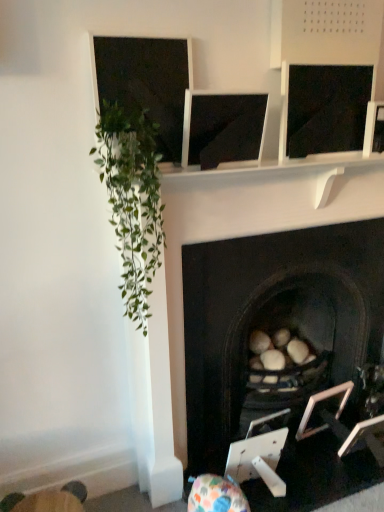
Describe the element at coordinates (276, 323) in the screenshot. I see `black stone fireplace at center` at that location.

What is the approximate height of metallic silver picture frame at lower right, marked as the first picture frame in a right-to-left arrangement?

metallic silver picture frame at lower right, marked as the first picture frame in a right-to-left arrangement, is 8.47 inches tall.

What do you see at coordinates (55, 500) in the screenshot?
I see `wooden swivel chair at lower left` at bounding box center [55, 500].

What do you see at coordinates (222, 128) in the screenshot?
I see `matte black monitor at center` at bounding box center [222, 128].

What do you see at coordinates (132, 201) in the screenshot? I see `green leafy plant at left` at bounding box center [132, 201].

Image resolution: width=384 pixels, height=512 pixels. Identify the location of black stone fireplace at center. (276, 323).

Looking at this image, is metallic silver picture frame at lower right, marked as the first picture frame in a right-to-left arrangement, inside wooden swivel chair at lower left?

No.

Is wooden swivel chair at lower left to the left or to the right of metallic silver picture frame at lower right, which ranks as the second picture frame in left-to-right order, in the image?

In the image, wooden swivel chair at lower left appears on the left side of metallic silver picture frame at lower right, which ranks as the second picture frame in left-to-right order.

Considering the sizes of wooden swivel chair at lower left and metallic silver picture frame at lower right, which ranks as the second picture frame in left-to-right order, in the image, is wooden swivel chair at lower left bigger or smaller than metallic silver picture frame at lower right, which ranks as the second picture frame in left-to-right order,?

In the image, wooden swivel chair at lower left appears to be larger than metallic silver picture frame at lower right, which ranks as the second picture frame in left-to-right order.

Could you tell me if wooden swivel chair at lower left is facing black stone fireplace at center?

No, wooden swivel chair at lower left is not aimed at black stone fireplace at center.

In the scene shown: Is wooden swivel chair at lower left shorter than black stone fireplace at center?

Yes, wooden swivel chair at lower left is shorter than black stone fireplace at center.

What's the angular difference between wooden swivel chair at lower left and black stone fireplace at center's facing directions?

The facing directions of wooden swivel chair at lower left and black stone fireplace at center are 7.02 degrees apart.

Is wooden swivel chair at lower left at the right side of black stone fireplace at center?

Incorrect, wooden swivel chair at lower left is not on the right side of black stone fireplace at center.

Is black stone fireplace at center situated inside metallic silver picture frame at lower right, marked as the first picture frame in a right-to-left arrangement, or outside?

black stone fireplace at center is located beyond the bounds of metallic silver picture frame at lower right, marked as the first picture frame in a right-to-left arrangement.

From a real-world perspective, is black stone fireplace at center under metallic silver picture frame at lower right, which ranks as the second picture frame in left-to-right order?

No.

Between black stone fireplace at center and metallic silver picture frame at lower right, which ranks as the second picture frame in left-to-right order, which one has larger size?

black stone fireplace at center is bigger.

Looking at this image, considering the positions of objects black stone fireplace at center and metallic silver picture frame at lower right, marked as the first picture frame in a right-to-left arrangement, in the image provided, who is more to the left, black stone fireplace at center or metallic silver picture frame at lower right, marked as the first picture frame in a right-to-left arrangement,?

From the viewer's perspective, black stone fireplace at center appears more on the left side.

The height and width of the screenshot is (512, 384). In order to click on picture frame on the left of metallic silver picture frame at lower right, which ranks as the second picture frame in left-to-right order in this screenshot , I will do `click(320, 401)`.

From the image's perspective, which is above, metallic silver picture frame at lower right, arranged as the 1th picture frame when viewed from the left, or metallic silver picture frame at lower right, marked as the first picture frame in a right-to-left arrangement?

metallic silver picture frame at lower right, arranged as the 1th picture frame when viewed from the left.

Considering the positions of point (343, 395) and point (349, 452), is point (343, 395) closer or farther from the camera than point (349, 452)?

Point (343, 395) appears to be farther away from the viewer than point (349, 452).

Looking at their sizes, would you say metallic silver picture frame at lower right, marked as the 2th picture frame in a right-to-left arrangement, is wider or thinner than metallic silver picture frame at lower right, marked as the first picture frame in a right-to-left arrangement?

metallic silver picture frame at lower right, marked as the 2th picture frame in a right-to-left arrangement, is thinner than metallic silver picture frame at lower right, marked as the first picture frame in a right-to-left arrangement.

From the image's perspective, is wooden swivel chair at lower left positioned above or below metallic silver picture frame at lower right, arranged as the 1th picture frame when viewed from the left?

Clearly, from the image's perspective, wooden swivel chair at lower left is below metallic silver picture frame at lower right, arranged as the 1th picture frame when viewed from the left.

Based on their sizes in the image, would you say wooden swivel chair at lower left is bigger or smaller than metallic silver picture frame at lower right, marked as the 2th picture frame in a right-to-left arrangement?

wooden swivel chair at lower left is smaller than metallic silver picture frame at lower right, marked as the 2th picture frame in a right-to-left arrangement.

Consider the image. Is wooden swivel chair at lower left inside or outside of metallic silver picture frame at lower right, arranged as the 1th picture frame when viewed from the left?

The correct answer is: outside.

Based on the photo, is there a large distance between wooden swivel chair at lower left and metallic silver picture frame at lower right, arranged as the 1th picture frame when viewed from the left?

Yes, wooden swivel chair at lower left is far from metallic silver picture frame at lower right, arranged as the 1th picture frame when viewed from the left.

Are black stone fireplace at center and wooden swivel chair at lower left making contact?

No, black stone fireplace at center is not in contact with wooden swivel chair at lower left.

Considering the positions of points (194, 466) and (78, 501), is point (194, 466) closer to camera compared to point (78, 501)?

That is False.

In order to click on fireplace on the right of wooden swivel chair at lower left in this screenshot , I will do `click(276, 323)`.

Considering the sizes of black stone fireplace at center and wooden swivel chair at lower left in the image, is black stone fireplace at center taller or shorter than wooden swivel chair at lower left?

Clearly, black stone fireplace at center is taller compared to wooden swivel chair at lower left.

Which is nearer, [133,174] or [369,438]?

Point [133,174]

From the image's perspective, who appears lower, green leafy plant at left or metallic silver picture frame at lower right, marked as the first picture frame in a right-to-left arrangement?

From the image's view, metallic silver picture frame at lower right, marked as the first picture frame in a right-to-left arrangement, is below.

Is metallic silver picture frame at lower right, which ranks as the second picture frame in left-to-right order, at the back of green leafy plant at left?

No, metallic silver picture frame at lower right, which ranks as the second picture frame in left-to-right order, is not at the back of green leafy plant at left.

This screenshot has height=512, width=384. In order to click on picture frame that is under the wooden swivel chair at lower left (from a real-world perspective) in this screenshot , I will do `click(366, 438)`.

The width and height of the screenshot is (384, 512). I want to click on fireplace located above the wooden swivel chair at lower left (from the image's perspective), so click(276, 323).

From the picture: Based on their spatial positions, is metallic silver picture frame at lower right, marked as the first picture frame in a right-to-left arrangement, or metallic silver picture frame at lower right, arranged as the 1th picture frame when viewed from the left, closer to matte black monitor at center?

metallic silver picture frame at lower right, marked as the first picture frame in a right-to-left arrangement, is closer to matte black monitor at center.

Based on their spatial positions, is metallic silver picture frame at lower right, which ranks as the second picture frame in left-to-right order, or metallic silver picture frame at lower right, marked as the 2th picture frame in a right-to-left arrangement, further from green leafy plant at left?

The object further to green leafy plant at left is metallic silver picture frame at lower right, marked as the 2th picture frame in a right-to-left arrangement.

From the image, which object appears to be farther from matte black monitor at center, metallic silver picture frame at lower right, marked as the first picture frame in a right-to-left arrangement, or wooden swivel chair at lower left?

wooden swivel chair at lower left lies further to matte black monitor at center than the other object.

When comparing their distances from metallic silver picture frame at lower right, marked as the first picture frame in a right-to-left arrangement, does matte black monitor at center or black stone fireplace at center seem closer?

black stone fireplace at center is positioned closer to the anchor metallic silver picture frame at lower right, marked as the first picture frame in a right-to-left arrangement.

Estimate the real-world distances between objects in this image. Which object is further from green leafy plant at left, matte black monitor at center or black stone fireplace at center?

The object further to green leafy plant at left is black stone fireplace at center.

Considering their positions, is metallic silver picture frame at lower right, marked as the first picture frame in a right-to-left arrangement, positioned closer to black stone fireplace at center than metallic silver picture frame at lower right, marked as the 2th picture frame in a right-to-left arrangement?

Based on the image, metallic silver picture frame at lower right, marked as the 2th picture frame in a right-to-left arrangement, appears to be nearer to black stone fireplace at center.

Estimate the real-world distances between objects in this image. Which object is closer to wooden swivel chair at lower left, black stone fireplace at center or metallic silver picture frame at lower right, which ranks as the second picture frame in left-to-right order?

black stone fireplace at center is closer to wooden swivel chair at lower left.

Based on their spatial positions, is matte black monitor at center or black stone fireplace at center further from wooden swivel chair at lower left?

The object further to wooden swivel chair at lower left is matte black monitor at center.

Find the location of a particular element. This screenshot has width=384, height=512. fireplace between green leafy plant at left and wooden swivel chair at lower left vertically is located at coordinates (276, 323).

The height and width of the screenshot is (512, 384). In order to click on fireplace between wooden swivel chair at lower left and metallic silver picture frame at lower right, arranged as the 1th picture frame when viewed from the left, from left to right in this screenshot , I will do [276, 323].

The width and height of the screenshot is (384, 512). I want to click on fireplace situated between green leafy plant at left and metallic silver picture frame at lower right, which ranks as the second picture frame in left-to-right order, from left to right, so click(x=276, y=323).

The height and width of the screenshot is (512, 384). What are the coordinates of `fireplace located between wooden swivel chair at lower left and metallic silver picture frame at lower right, marked as the first picture frame in a right-to-left arrangement, in the left-right direction` in the screenshot? It's located at pyautogui.click(x=276, y=323).